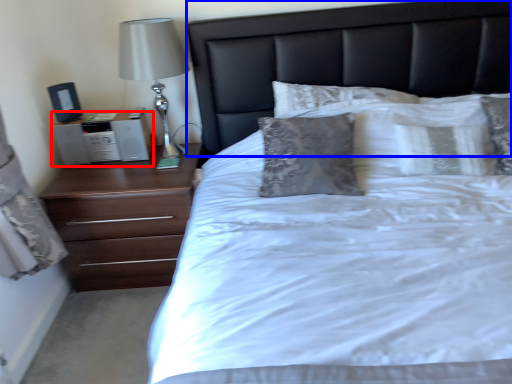
Question: Among these objects, which one is nearest to the camera, nightstand (highlighted by a red box) or headboard (highlighted by a blue box)?

Choices:
 (A) nightstand
 (B) headboard

Answer: (B)